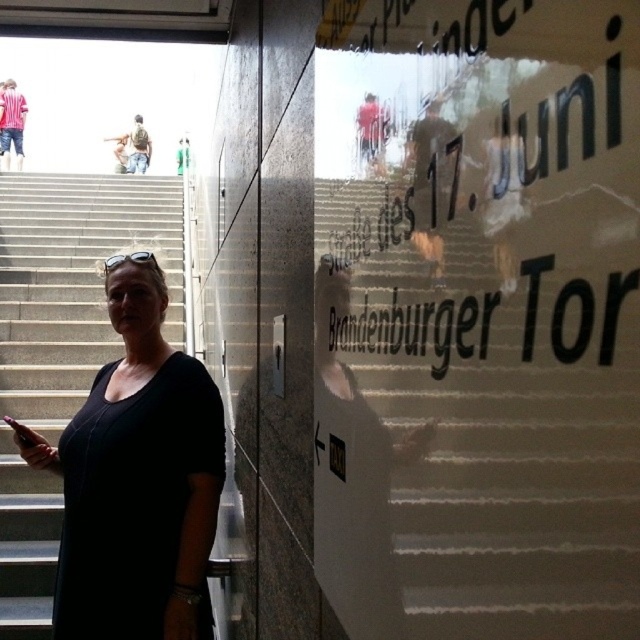
Who is taller, black matte dress at center or camouflage fabric shirt at upper left?

With more height is camouflage fabric shirt at upper left.

Locate an element on the screen. black matte dress at center is located at coordinates (136, 477).

Does denim jacket at upper left have a larger size compared to camouflage fabric shirt at upper left?

Correct, denim jacket at upper left is larger in size than camouflage fabric shirt at upper left.

Where is `denim jacket at upper left`? The image size is (640, 640). denim jacket at upper left is located at coordinates (12, 122).

Between point (19, 97) and point (140, 116), which one is positioned behind?

The point (140, 116) is more distant.

This screenshot has height=640, width=640. Identify the location of denim jacket at upper left. (12, 122).

Can you confirm if black matte dress at center is shorter than denim jacket at upper left?

Yes.

Between point (81, 516) and point (1, 108), which one is positioned behind?

Point (1, 108)

Is point (209, 625) closer to camera compared to point (4, 152)?

That is True.

Where is `black matte dress at center`? This screenshot has height=640, width=640. black matte dress at center is located at coordinates (136, 477).